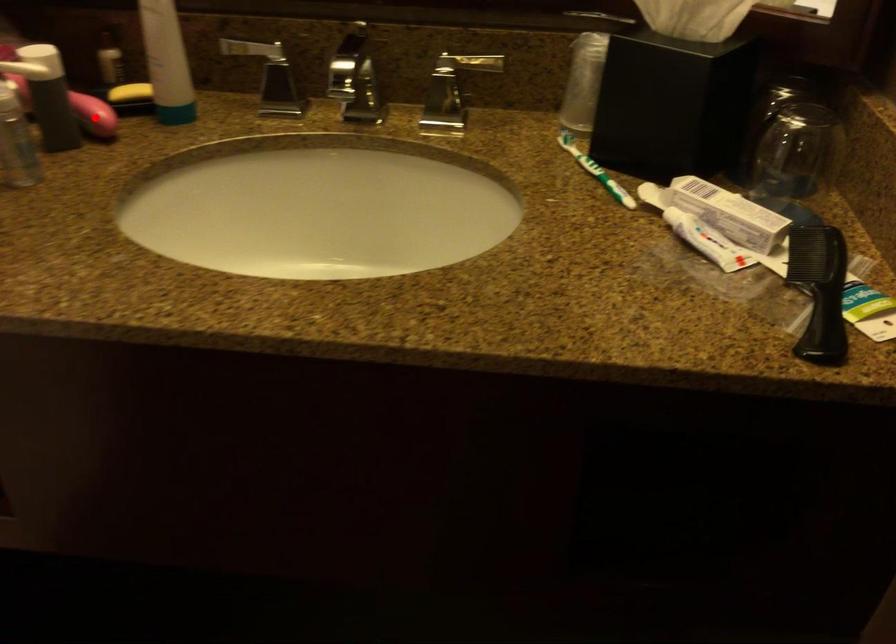
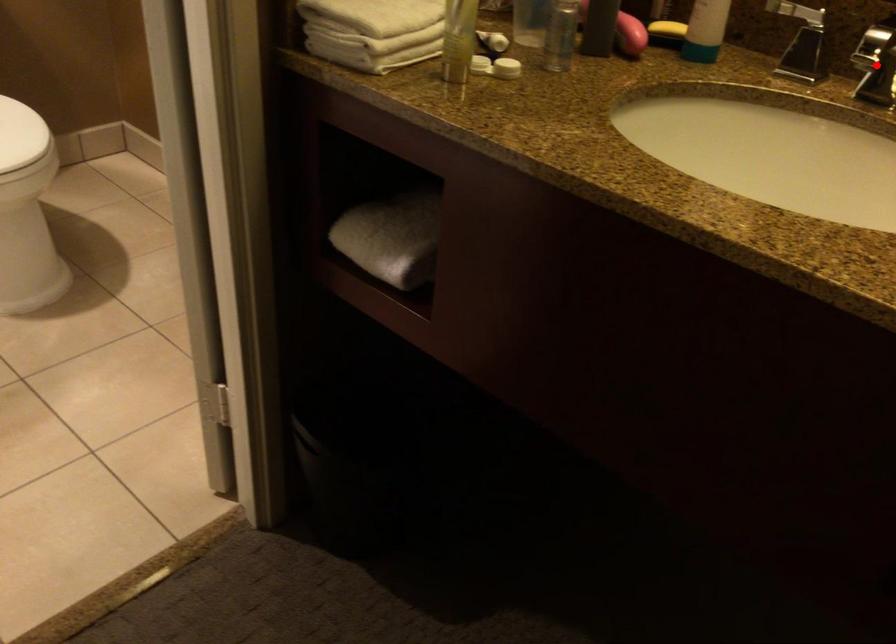
I am providing you with two images of the same scene from different viewpoints. A red point is marked on the first image and another point is marked on the second image. Is the marked point in image1 the same physical position as the marked point in image2?

No